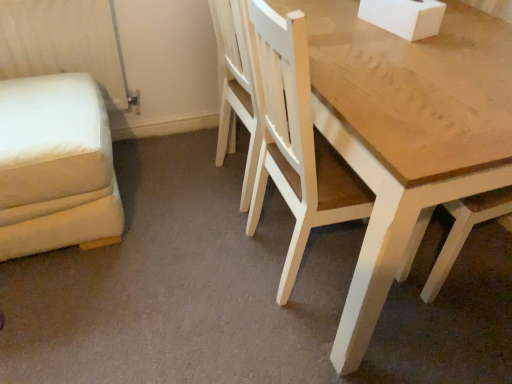
At what (x,y) coordinates should I click in order to perform the action: click on vacant space that is to the left of light wood chair at center. Please return your answer as a coordinate pair (x, y). The image size is (512, 384). Looking at the image, I should click on (192, 253).